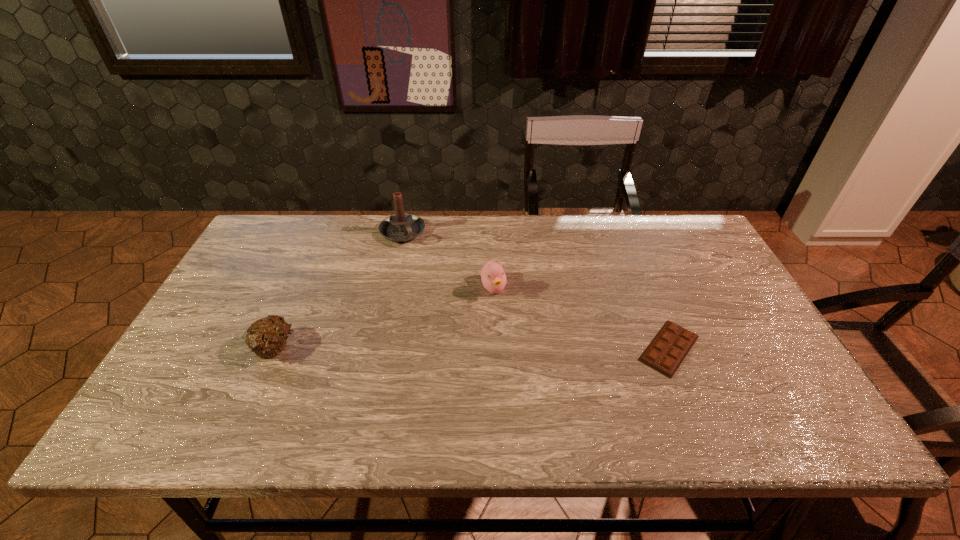
The height and width of the screenshot is (540, 960). Identify the location of vacant area that lies between the second object from right to left and the leftmost object. (383, 318).

What are the coordinates of `free space between the leftmost object and the shortest object` in the screenshot? It's located at (471, 348).

Where is `vacant area that lies between the tallest object and the duckling`? The image size is (960, 540). vacant area that lies between the tallest object and the duckling is located at coordinates (447, 260).

I want to click on vacant space that's between the third object from right to left and the second tallest object, so click(447, 260).

Identify the location of blank region between the shortest object and the second farthest object. This screenshot has height=540, width=960. (581, 318).

Identify the location of the closest object to the third nearest object. Image resolution: width=960 pixels, height=540 pixels. (400, 227).

Where is `object that is the third nearest to the duckling`? The image size is (960, 540). object that is the third nearest to the duckling is located at coordinates point(266,338).

Where is `free spot that satisfies the following two spatial constraints: 1. on the front side of the leftmost object; 2. on the left side of the shortest object`? free spot that satisfies the following two spatial constraints: 1. on the front side of the leftmost object; 2. on the left side of the shortest object is located at coordinates (274, 348).

Image resolution: width=960 pixels, height=540 pixels. Identify the location of vacant position in the image that satisfies the following two spatial constraints: 1. on the front side of the rightmost object; 2. on the right side of the second tallest object. pos(495,348).

Identify the location of free space that satisfies the following two spatial constraints: 1. on the front side of the farthest object; 2. on the left side of the third shortest object. The image size is (960, 540). (390, 288).